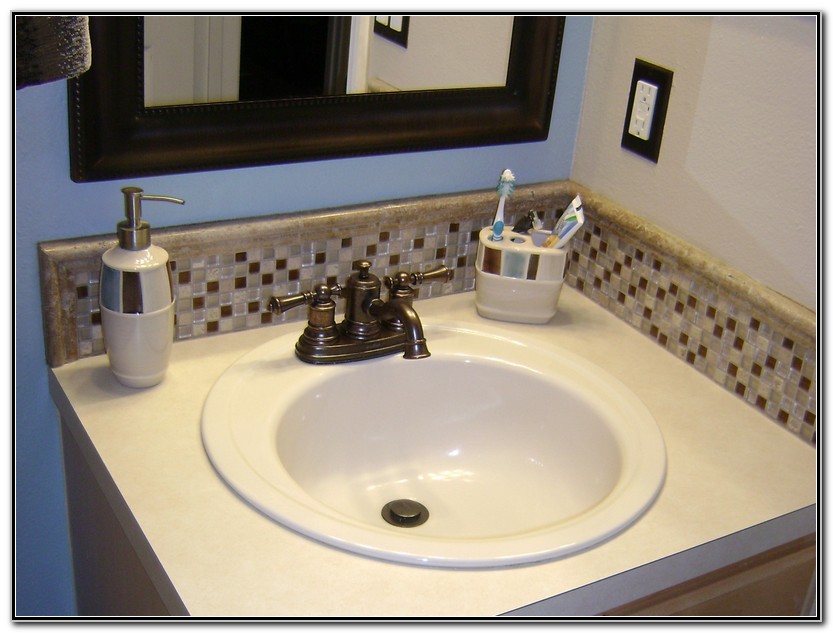
At what (x,y) coordinates should I click in order to perform the action: click on white wall background. Please return your answer as a coordinate pair (x, y). Looking at the image, I should click on (685, 27).